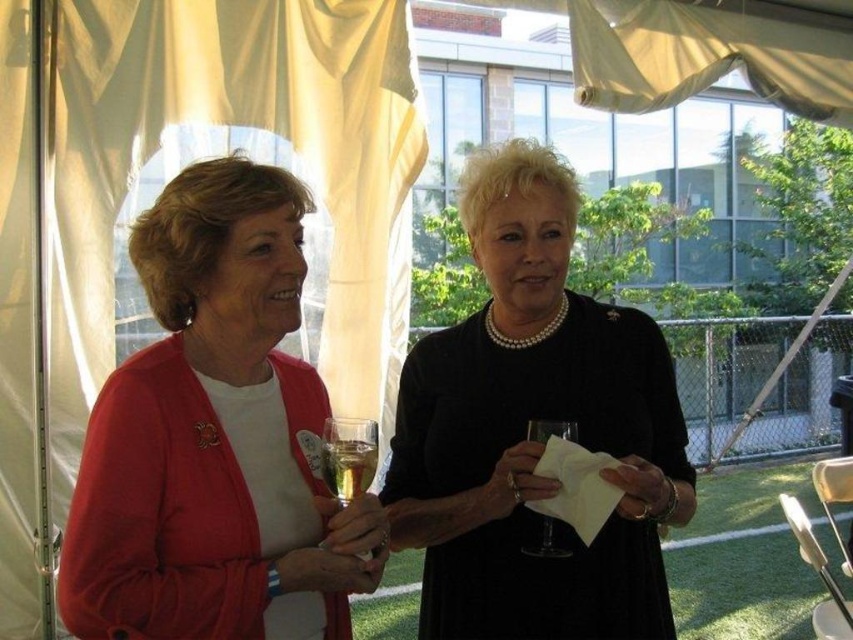
Can you confirm if black pearl necklace at center is positioned below translucent glass at center?

No, black pearl necklace at center is not below translucent glass at center.

Is point (497, 538) in front of point (355, 438)?

No, it is behind (355, 438).

Identify the location of black pearl necklace at center. (526, 428).

Is point (570, 17) in front of point (370, 449)?

No, (570, 17) is further to viewer.

Can you confirm if white fabric curtain at upper center is taller than clear glass wine glass at center?

Indeed, white fabric curtain at upper center has a greater height compared to clear glass wine glass at center.

Locate an element on the screen. Image resolution: width=853 pixels, height=640 pixels. white fabric curtain at upper center is located at coordinates (704, 56).

At what (x,y) coordinates should I click in order to perform the action: click on white fabric curtain at upper center. Please return your answer as a coordinate pair (x, y). Looking at the image, I should click on (704, 56).

How far apart are matte red cardigan at center and black pearl necklace at center?

The distance of matte red cardigan at center from black pearl necklace at center is 13.12 inches.

Who is more forward, (172, 602) or (602, 596)?

Point (172, 602)

Where is `matte red cardigan at center`? This screenshot has width=853, height=640. matte red cardigan at center is located at coordinates (215, 438).